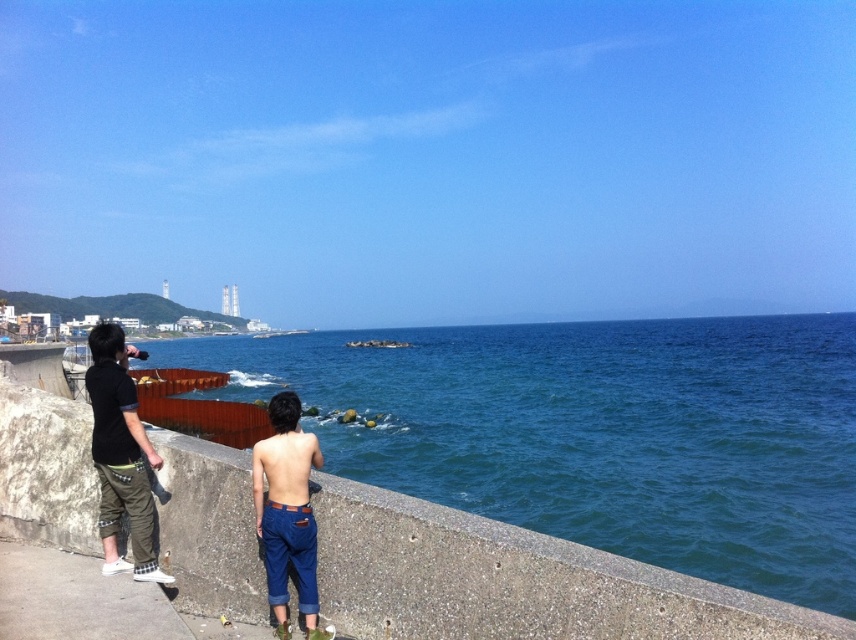
You are a photographer trying to capture a photo of the blue water at center and denim pants at center. Which object is positioned higher in the image?

The blue water at center is above denim pants at center, so the blue water at center is positioned higher in the image.

You are standing at the point closer to the ocean in the image. Which point are you at, point (791, 317) or point (129, 470)?

You are at point (129, 470) because it is in front of point (791, 317), meaning it is closer to the ocean and the viewer.